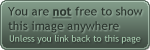
Locate an element on the screen. rounded corner is located at coordinates (2, 2), (148, 2), (148, 47), (3, 47).